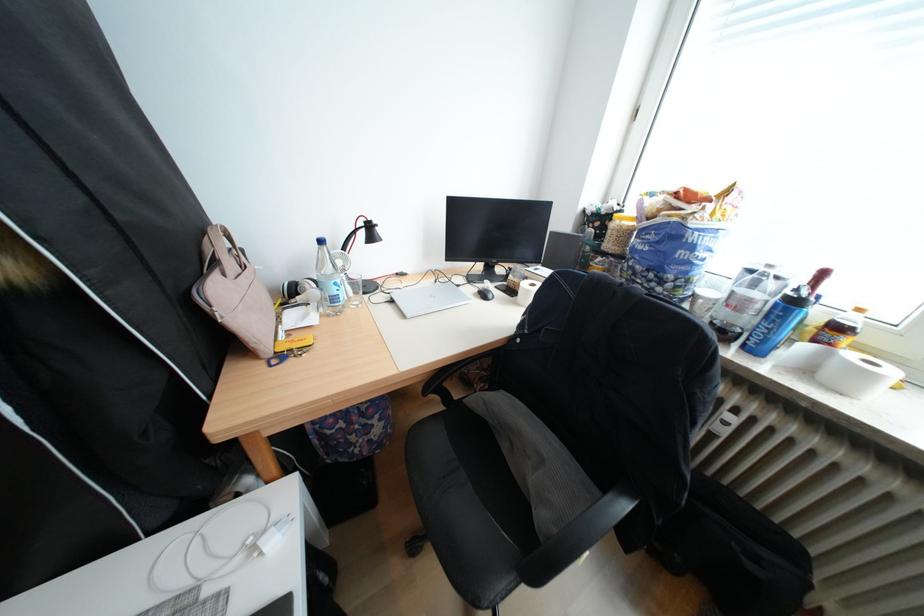
Where is `beige handbag handle`? beige handbag handle is located at coordinates (222, 252).